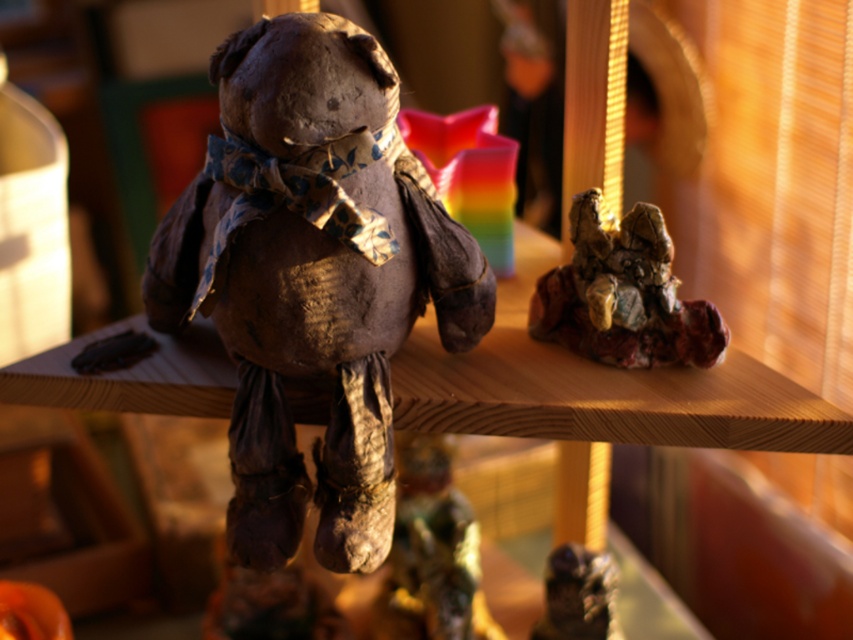
Question: Which point is closer to the camera taking this photo?

Choices:
 (A) (561, 602)
 (B) (45, 605)
 (C) (645, 212)

Answer: (C)

Question: Does shiny metallic dinosaur at center appear over matte orange pumpkin at lower left?

Choices:
 (A) no
 (B) yes

Answer: (B)

Question: Among these points, which one is farthest from the camera?

Choices:
 (A) (602, 244)
 (B) (18, 604)
 (C) (448, 561)

Answer: (C)

Question: In this image, where is matte clay bear at center located relative to rusty metal figurine at lower center?

Choices:
 (A) above
 (B) below

Answer: (A)

Question: Can you confirm if matte clay bear at center is positioned above rusty metal figurine at lower center?

Choices:
 (A) yes
 (B) no

Answer: (A)

Question: Which is nearer to the crinkled paper sculpture at right?

Choices:
 (A) rusty metal figurine at lower center
 (B) matte clay bear at center
 (C) shiny metallic dinosaur at center
 (D) matte orange pumpkin at lower left

Answer: (B)